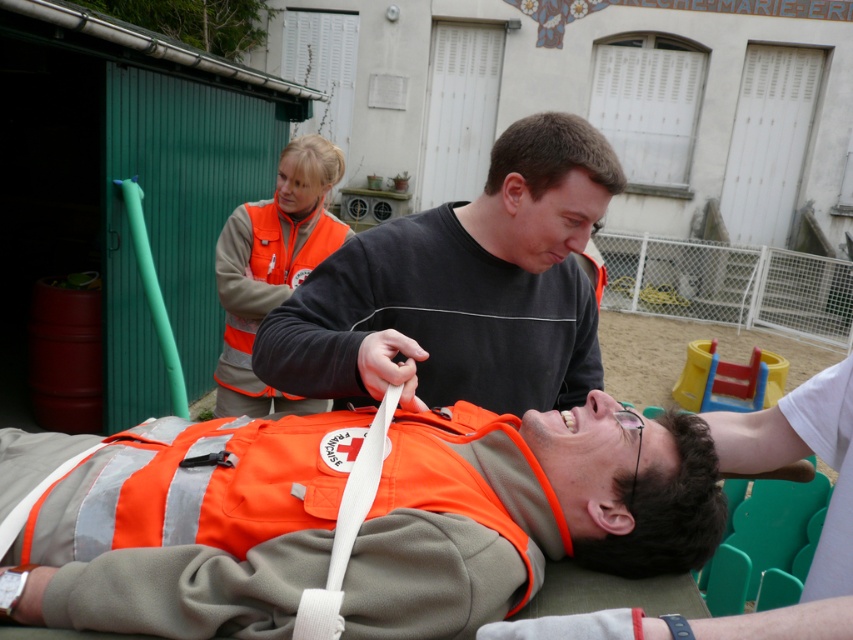
Question: Can you confirm if matte black shirt at center is smaller than orange fabric vest at center?

Choices:
 (A) no
 (B) yes

Answer: (A)

Question: Is matte black shirt at center further to camera compared to orange fabric vest at center?

Choices:
 (A) no
 (B) yes

Answer: (B)

Question: Which object is farther from the camera taking this photo?

Choices:
 (A) matte black shirt at center
 (B) orange fabric vest at center

Answer: (A)

Question: Is matte black shirt at center behind orange fabric vest at center?

Choices:
 (A) yes
 (B) no

Answer: (A)